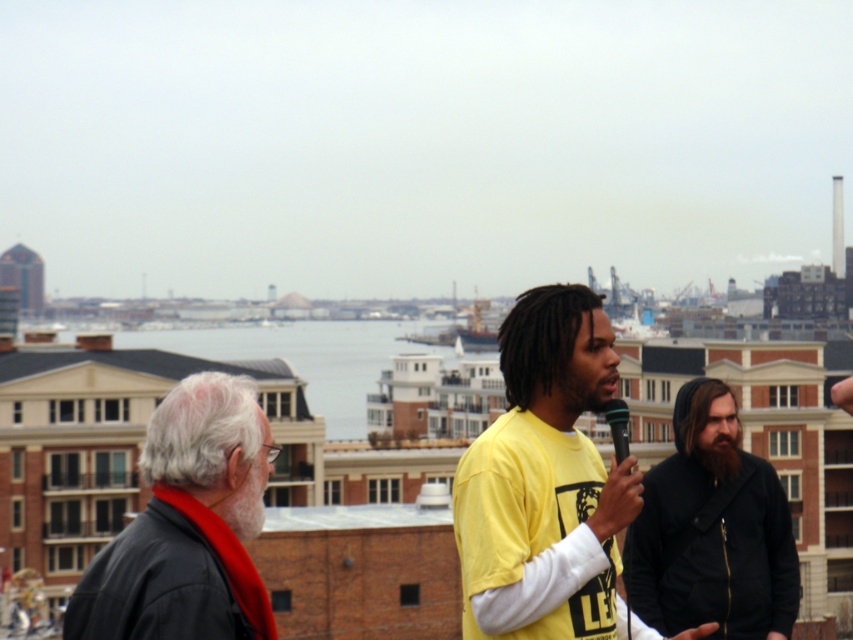
Question: Estimate the real-world distances between objects in this image. Which object is farther from the black leather jacket at left?

Choices:
 (A) black matte microphone at center
 (B) yellow matte shirt at center

Answer: (A)

Question: Observing the image, what is the correct spatial positioning of yellow matte shirt at center in reference to black hoodie at center?

Choices:
 (A) below
 (B) above

Answer: (B)

Question: Which point appears farthest from the camera in this image?

Choices:
 (A) (469, 486)
 (B) (728, 433)
 (C) (190, 454)

Answer: (B)

Question: From the image, what is the correct spatial relationship of yellow matte shirt at center in relation to black matte microphone at center?

Choices:
 (A) above
 (B) below

Answer: (B)

Question: Which object is the closest to the black leather jacket at left?

Choices:
 (A) black matte microphone at center
 (B) black hoodie at center

Answer: (A)

Question: Does yellow matte shirt at center appear over black matte microphone at center?

Choices:
 (A) no
 (B) yes

Answer: (A)